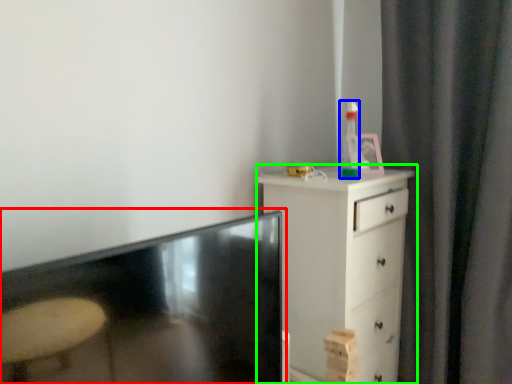
Question: Which object is the farthest from table (highlighted by a red box)? Choose among these: bottle (highlighted by a blue box) or chest of drawers (highlighted by a green box).

Choices:
 (A) bottle
 (B) chest of drawers

Answer: (A)